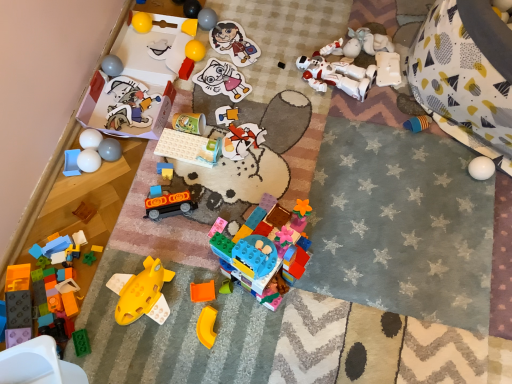
Locate an element on the screen. This screenshot has height=384, width=512. unoccupied region to the right of yellow rubber ball at upper center, the tenth toy from the right is located at coordinates (240, 59).